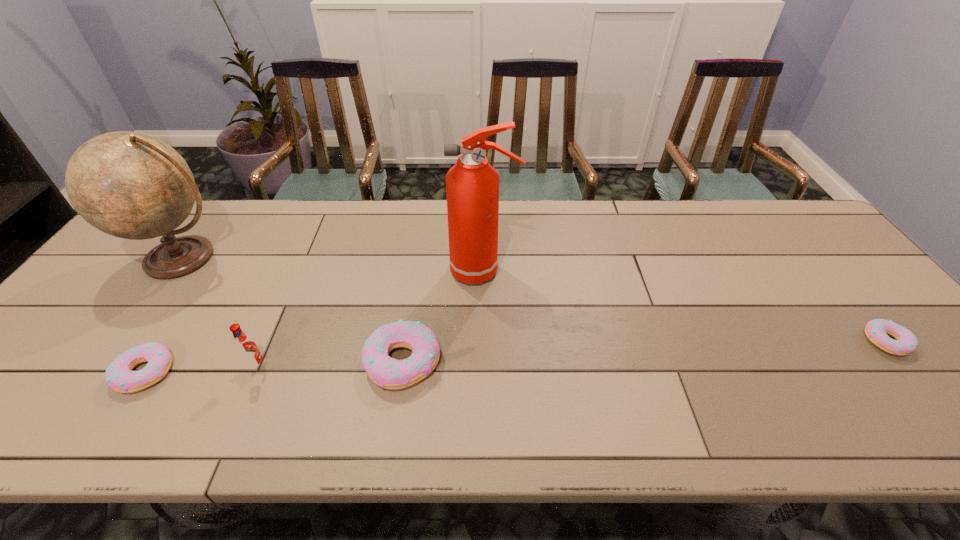
Image resolution: width=960 pixels, height=540 pixels. In order to click on vacant point located 0.340m on the right of the second shortest doughnut in this screenshot , I will do `click(324, 373)`.

I want to click on free space located 0.260m on the left of the third shortest object, so click(x=251, y=362).

Identify the location of free space located 0.180m on the back of the rightmost object. The image size is (960, 540). (831, 275).

Where is `free point located 0.070m at the nozzle of the fire extinguisher`? free point located 0.070m at the nozzle of the fire extinguisher is located at coordinates (425, 271).

You are a GUI agent. You are given a task and a screenshot of the screen. Output one action in this format:
    pyautogui.click(x=<x>, y=<y>)
    Task: Click on the free space located at the nozzle of the fire extinguisher
    
    Given the screenshot: What is the action you would take?
    pyautogui.click(x=414, y=271)

You are a GUI agent. You are given a task and a screenshot of the screen. Output one action in this format:
    pyautogui.click(x=<x>, y=<y>)
    Task: Click on the vacant area located at the nozzle of the fire extinguisher
    
    Given the screenshot: What is the action you would take?
    pyautogui.click(x=396, y=271)

Image resolution: width=960 pixels, height=540 pixels. I want to click on vacant space situated on the front-facing side of the globe, so click(x=91, y=385).

At what (x,y) coordinates should I click in order to perform the action: click on vacant region located on the left of the fourth shortest object. Please return your answer as a coordinate pair (x, y). The width and height of the screenshot is (960, 540). Looking at the image, I should click on (201, 367).

Locate an element on the screen. The image size is (960, 540). object at the far edge is located at coordinates (130, 185).

The width and height of the screenshot is (960, 540). I want to click on root beer that is positioned at the near edge, so click(246, 348).